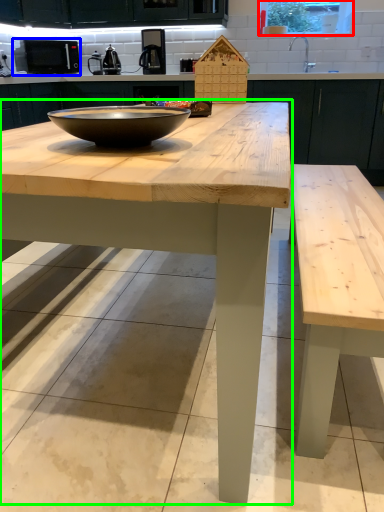
Question: Based on their relative distances, which object is farther from window screen (highlighted by a red box)? Choose from appliance (highlighted by a blue box) and table (highlighted by a green box).

Choices:
 (A) appliance
 (B) table

Answer: (B)